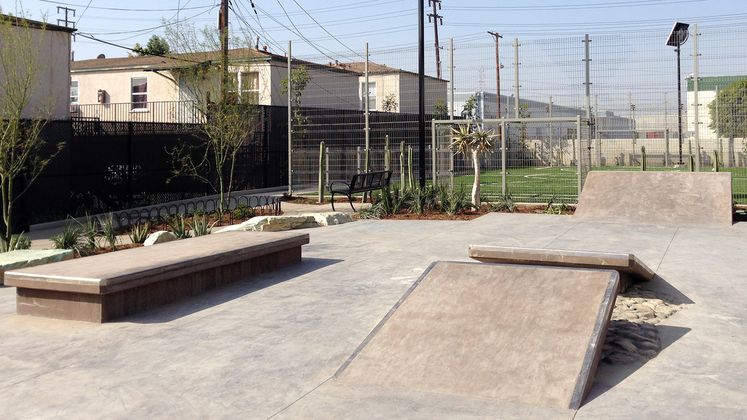
Locate an element on the screen. This screenshot has height=420, width=747. bench is located at coordinates (365, 181).